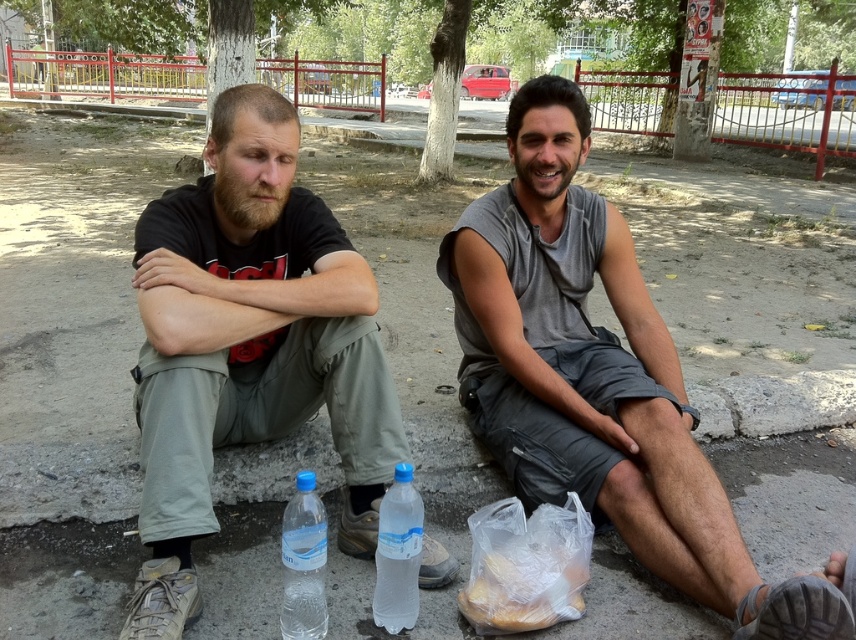
Can you confirm if matte black shirt at center is positioned below gray fabric sleeve at lower right?

Incorrect, matte black shirt at center is not positioned below gray fabric sleeve at lower right.

Who is shorter, matte black shirt at center or gray fabric sleeve at lower right?

With less height is gray fabric sleeve at lower right.

What are the coordinates of `matte black shirt at center` in the screenshot? It's located at (x=248, y=346).

Between point (354, 500) and point (391, 563), which one is positioned behind?

Positioned behind is point (354, 500).

Between matte black shirt at center and translucent plastic bottle at lower center, which one appears on the right side from the viewer's perspective?

Positioned to the right is translucent plastic bottle at lower center.

Describe the element at coordinates (248, 346) in the screenshot. Image resolution: width=856 pixels, height=640 pixels. I see `matte black shirt at center` at that location.

The height and width of the screenshot is (640, 856). What are the coordinates of `matte black shirt at center` in the screenshot? It's located at click(x=248, y=346).

Does gray fabric sleeve at lower right lie behind transparent plastic bottle at center?

That is True.

Who is more distant from viewer, (486, 326) or (296, 518)?

Point (486, 326)

Between point (502, 298) and point (304, 604), which one is positioned in front?

Positioned in front is point (304, 604).

At what (x,y) coordinates should I click in order to perform the action: click on gray fabric sleeve at lower right. Please return your answer as a coordinate pair (x, y). This screenshot has height=640, width=856. Looking at the image, I should click on (x=521, y=339).